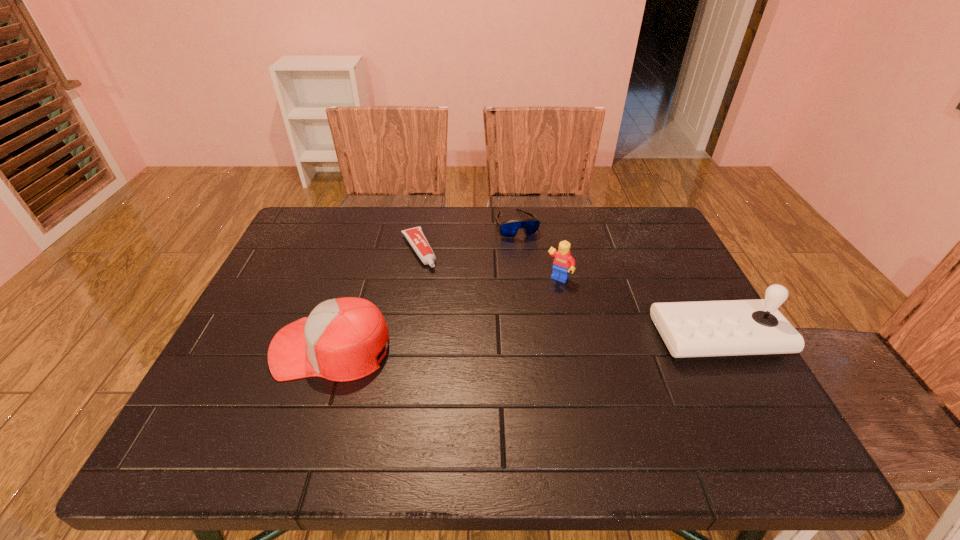
Image resolution: width=960 pixels, height=540 pixels. I want to click on free space between the shortest object and the second shortest object, so click(468, 237).

You are a GUI agent. You are given a task and a screenshot of the screen. Output one action in this format:
    pyautogui.click(x=<x>, y=<y>)
    Task: Click on the vacant region between the baseball cap and the toothpaste
    This screenshot has width=960, height=540.
    Given the screenshot: What is the action you would take?
    pyautogui.click(x=375, y=299)

Where is `vacant area that lies between the shortest object and the tallest object`? vacant area that lies between the shortest object and the tallest object is located at coordinates (567, 294).

The image size is (960, 540). I want to click on free space between the toothpaste and the Lego, so click(x=489, y=265).

In order to click on vacant space in between the Lego and the sunglasses in this screenshot , I will do `click(538, 251)`.

Where is `vacant area that lies between the sunglasses and the baseball cap`? This screenshot has height=540, width=960. vacant area that lies between the sunglasses and the baseball cap is located at coordinates (424, 286).

Locate an element on the screen. free space between the baseball cap and the tallest object is located at coordinates (524, 342).

At what (x,y) coordinates should I click in order to perform the action: click on blank region between the baseball cap and the Lego. Please return your answer as a coordinate pair (x, y). The width and height of the screenshot is (960, 540). Looking at the image, I should click on (445, 313).

You are a GUI agent. You are given a task and a screenshot of the screen. Output one action in this format:
    pyautogui.click(x=<x>, y=<y>)
    Task: Click on the vacant area between the fourth tallest object and the toothpaste
    This screenshot has width=960, height=540.
    Given the screenshot: What is the action you would take?
    pyautogui.click(x=468, y=237)

At what (x,y) coordinates should I click in order to perform the action: click on object identified as the second closest to the toothpaste. Please return your answer as a coordinate pair (x, y). Looking at the image, I should click on (340, 340).